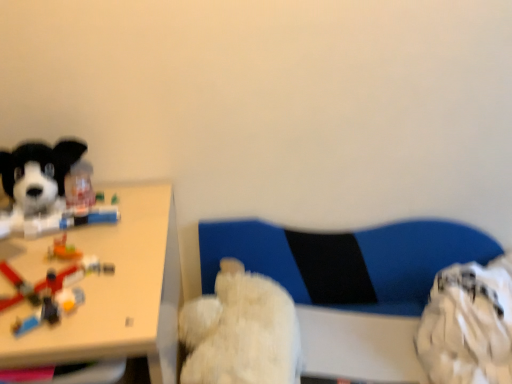
Where is `vacant space to the right of translucent plastic toy at left`? vacant space to the right of translucent plastic toy at left is located at coordinates (130, 285).